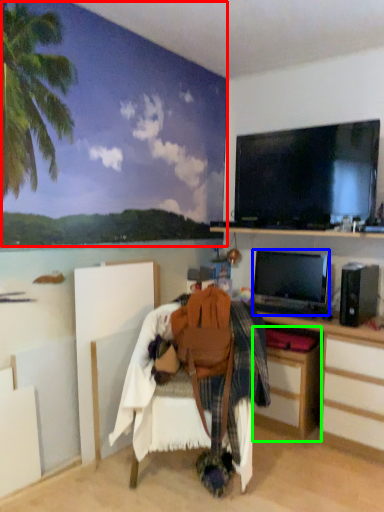
Question: Which object is positioned farthest from backdrop (highlighted by a red box)? Select from television (highlighted by a blue box) and cabinetry (highlighted by a green box).

Choices:
 (A) television
 (B) cabinetry

Answer: (B)